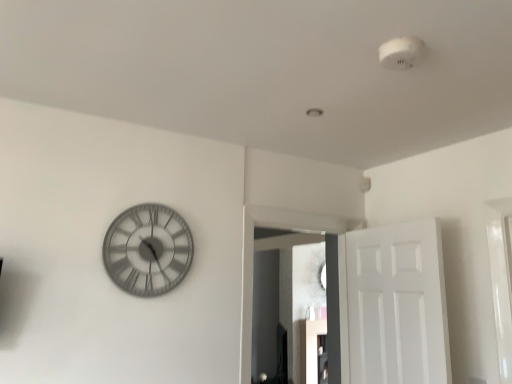
Question: Considering the relative sizes of metallic gray clock at left and white matte door at right in the image provided, is metallic gray clock at left shorter than white matte door at right?

Choices:
 (A) no
 (B) yes

Answer: (B)

Question: Is metallic gray clock at left far from white matte door at right?

Choices:
 (A) yes
 (B) no

Answer: (A)

Question: Are metallic gray clock at left and white matte door at right beside each other?

Choices:
 (A) yes
 (B) no

Answer: (B)

Question: From the image's perspective, does metallic gray clock at left appear lower than white matte door at right?

Choices:
 (A) no
 (B) yes

Answer: (A)

Question: Considering the relative sizes of metallic gray clock at left and white matte door at right in the image provided, is metallic gray clock at left thinner than white matte door at right?

Choices:
 (A) yes
 (B) no

Answer: (A)

Question: Does metallic gray clock at left have a greater height compared to white matte door at right?

Choices:
 (A) no
 (B) yes

Answer: (A)

Question: Is white matte door at right bigger than matte glass mirror at center?

Choices:
 (A) yes
 (B) no

Answer: (B)

Question: Is white matte door at right beside matte glass mirror at center?

Choices:
 (A) no
 (B) yes

Answer: (A)

Question: Is white matte door at right smaller than matte glass mirror at center?

Choices:
 (A) no
 (B) yes

Answer: (B)

Question: Does white matte door at right appear on the left side of matte glass mirror at center?

Choices:
 (A) no
 (B) yes

Answer: (A)

Question: From the image's perspective, is white matte door at right above matte glass mirror at center?

Choices:
 (A) yes
 (B) no

Answer: (A)

Question: From a real-world perspective, is white matte door at right over matte glass mirror at center?

Choices:
 (A) no
 (B) yes

Answer: (A)

Question: Would you say matte glass mirror at center contains white matte door at right?

Choices:
 (A) no
 (B) yes

Answer: (A)